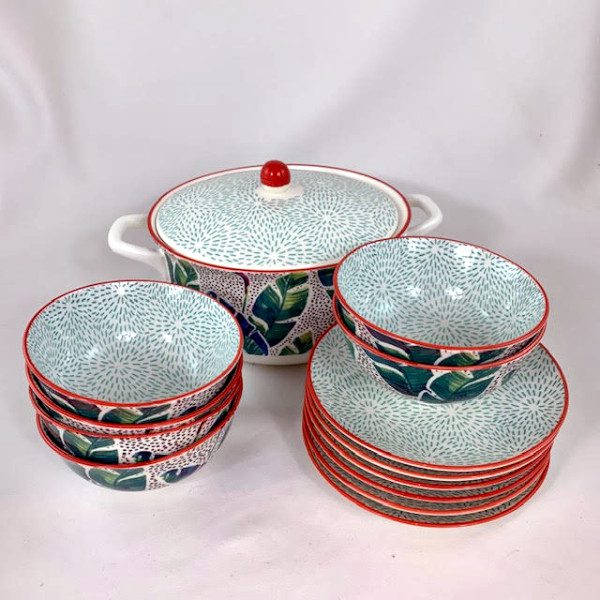
This screenshot has width=600, height=600. Find the location of `decorative plates`. decorative plates is located at coordinates 401,426, 403,471, 404,483, 408,493, 410,508, 412,519, 418,462.